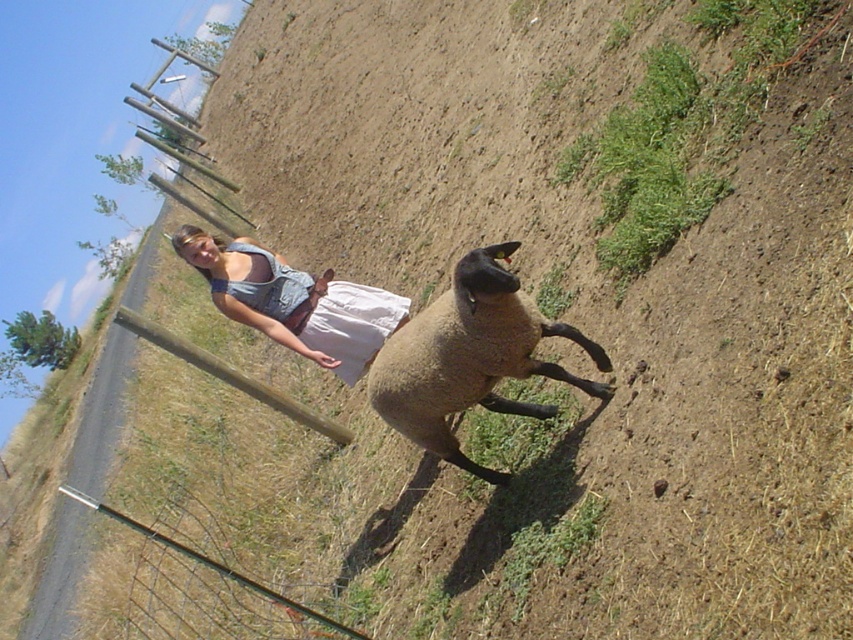
You are a photographer trying to capture the scene with a wide angle lens. You notice the denim overalls at center and the metal wire fence at lower left in your frame. Which object should you focus on first if you want to ensure both are in focus, considering their sizes?

The denim overalls at center is larger in size compared to the metal wire fence at lower left, so focusing on the denim overalls at center will help ensure both are in focus.

Consider the image. You are a photographer trying to capture a clear photo of the brown woolen sheep at center and the metal wire fence at lower left. Which object will appear closer to the camera in the photo?

The brown woolen sheep at center will appear closer to the camera in the photo because it is positioned in front of the metal wire fence at lower left.

You are standing at the point with coordinates point (80,492) and want to walk towards the woman standing near the wooden fence. Which direction should you move relative to point (488,294)?

You should move towards point (488,294) because it is in front of point (80,492), so moving towards it would lead you in the direction of the woman near the wooden fence.